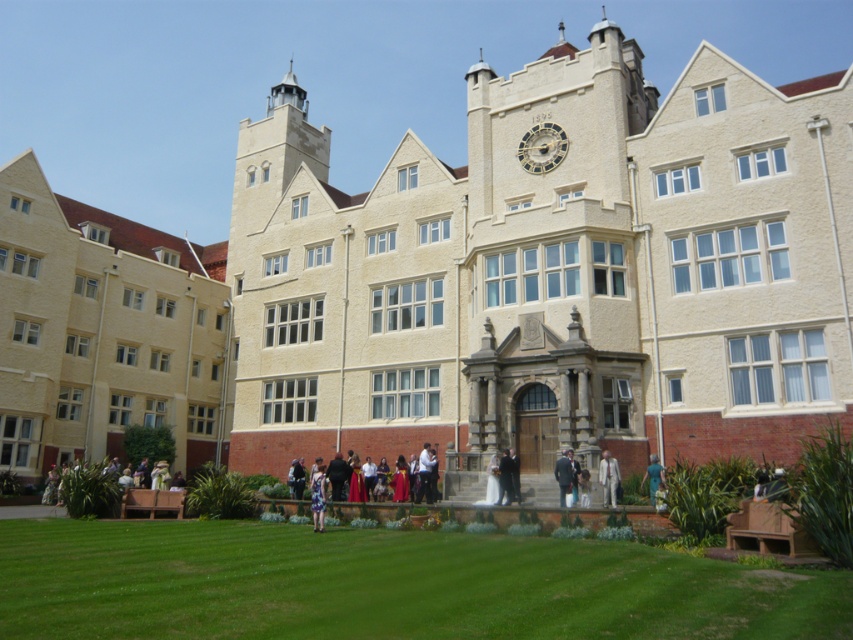
Question: Is green grass at lower center above gold-toned metal clock at upper center?

Choices:
 (A) yes
 (B) no

Answer: (B)

Question: Can you confirm if dark gray suit at center is positioned below light gray suit at center?

Choices:
 (A) yes
 (B) no

Answer: (A)

Question: Which object is positioned farthest from the green grass at lower center?

Choices:
 (A) light gray suit at center
 (B) gold-toned metal clock at upper center

Answer: (B)

Question: Which point is farther to the camera?

Choices:
 (A) (653, 493)
 (B) (560, 468)

Answer: (B)

Question: From the image, what is the correct spatial relationship of gold-toned metal clock at upper center in relation to dark gray suit at center?

Choices:
 (A) right
 (B) left

Answer: (A)

Question: Which point appears farthest from the camera in this image?

Choices:
 (A) (605, 570)
 (B) (656, 484)

Answer: (B)